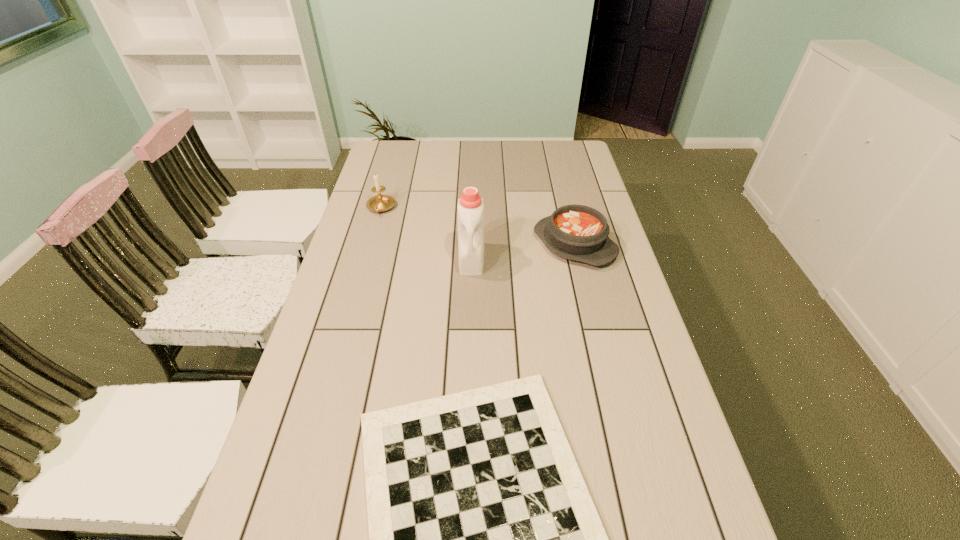
Where is `vacant space that satisfies the following two spatial constraints: 1. with a handle on the side of the farthest object; 2. on the right side of the third tallest object`? The width and height of the screenshot is (960, 540). vacant space that satisfies the following two spatial constraints: 1. with a handle on the side of the farthest object; 2. on the right side of the third tallest object is located at coordinates (371, 244).